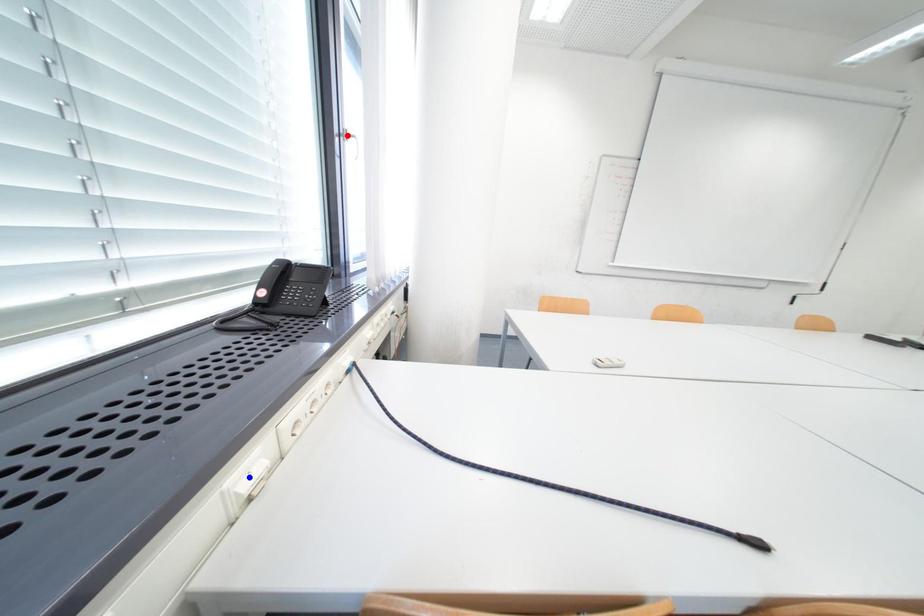
Question: Two points are marked on the image. Which point is closer to the camera?

Choices:
 (A) Blue point is closer.
 (B) Red point is closer.

Answer: (A)